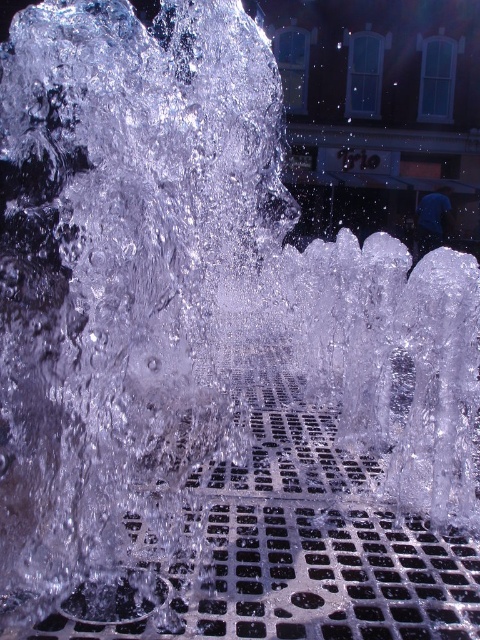
Question: Among these objects, which one is farthest from the camera?

Choices:
 (A) metallic grid at lower center
 (B) metallic grid at center

Answer: (A)

Question: Which object is closer to the camera taking this photo?

Choices:
 (A) metallic grid at center
 (B) metallic grid at lower center

Answer: (A)

Question: Can you confirm if metallic grid at center is bigger than metallic grid at lower center?

Choices:
 (A) no
 (B) yes

Answer: (B)

Question: Is the position of metallic grid at center less distant than that of metallic grid at lower center?

Choices:
 (A) no
 (B) yes

Answer: (B)

Question: Can you confirm if metallic grid at center is wider than metallic grid at lower center?

Choices:
 (A) yes
 (B) no

Answer: (A)